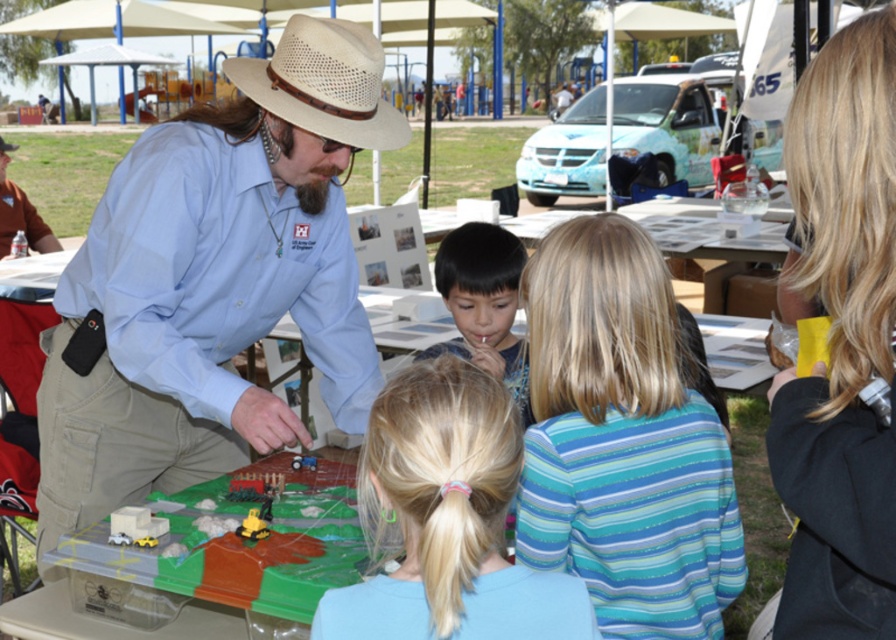
You are a photographer at the event and want to capture a photo of the light blue shirt at center without the matte black phone at left appearing in the background. Is this possible based on their positions?

The light blue shirt at center is in front of the matte black phone at left, so yes, you can take a photo of the light blue shirt at center without the matte black phone at left showing in the background as it is obscured by the shirt.

You are a photographer at the event and want to take a photo of both the blue striped shirt at center and the blonde hair at center in the same frame. Your camera has a maximum focus range that can capture objects within 14 inches of each other. Will both subjects fit within the camera focus range?

The blue striped shirt at center and blonde hair at center are 12.91 inches apart, which is within the camera focus range of 14 inches. Both subjects will fit within the camera focus range.

From the picture: You are attending an outdoor event and need to place a small sticker on the object that is narrower between the beige woven hat at center and the matte black phone at left. Which object should you choose?

The beige woven hat at center is narrower than the matte black phone at left, so you should place the sticker on the beige woven hat at center.